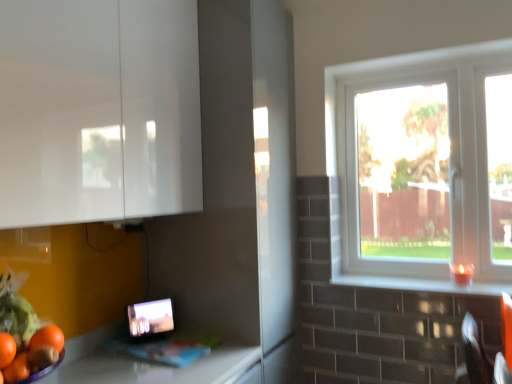
Question: From the image's perspective, relative to white plastic window at right, is white glossy window sill at right above or below?

Choices:
 (A) below
 (B) above

Answer: (A)

Question: From a real-world perspective, relative to white plastic window at right, is white glossy window sill at right vertically above or below?

Choices:
 (A) above
 (B) below

Answer: (B)

Question: Estimate the real-world distances between objects in this image. Which object is closer to the matte black tablet at lower left?

Choices:
 (A) white glossy window sill at right
 (B) white glossy cabinet at upper left
 (C) white plastic window at right

Answer: (B)

Question: Based on their relative distances, which object is farther from the matte black tablet at lower left?

Choices:
 (A) white glossy window sill at right
 (B) white glossy cabinet at upper left
 (C) white plastic window at right

Answer: (C)